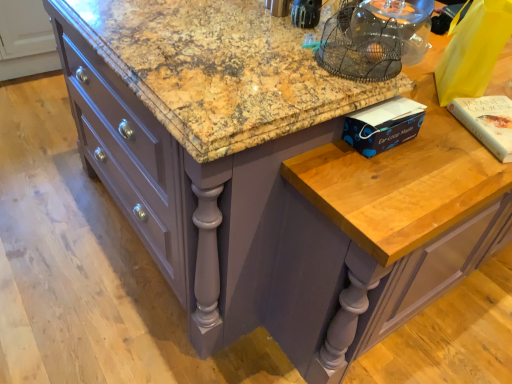
Question: Is blue paper ear-loop masks at right, marked as the first book in a left-to-right arrangement, in front of or behind white paper book at upper right, the first book when ordered from right to left, in the image?

Choices:
 (A) behind
 (B) front

Answer: (B)

Question: Is blue paper ear-loop masks at right, which is counted as the second book, starting from the right, taller or shorter than white paper book at upper right, the second book when ordered from left to right?

Choices:
 (A) short
 (B) tall

Answer: (B)

Question: From a real-world perspective, is blue paper ear-loop masks at right, which is counted as the second book, starting from the right, physically located above or below white paper book at upper right, the first book when ordered from right to left?

Choices:
 (A) below
 (B) above

Answer: (B)

Question: From their relative heights in the image, would you say white paper book at upper right, the first book when ordered from right to left, is taller or shorter than blue paper ear-loop masks at right, which is counted as the second book, starting from the right?

Choices:
 (A) tall
 (B) short

Answer: (B)

Question: From the image's perspective, is white paper book at upper right, the second book when ordered from left to right, located above or below blue paper ear-loop masks at right, marked as the first book in a left-to-right arrangement?

Choices:
 (A) below
 (B) above

Answer: (B)

Question: Is white paper book at upper right, the first book when ordered from right to left, wider or thinner than blue paper ear-loop masks at right, which is counted as the second book, starting from the right?

Choices:
 (A) wide
 (B) thin

Answer: (A)

Question: Is white paper book at upper right, the first book when ordered from right to left, spatially inside blue paper ear-loop masks at right, which is counted as the second book, starting from the right, or outside of it?

Choices:
 (A) outside
 (B) inside

Answer: (A)